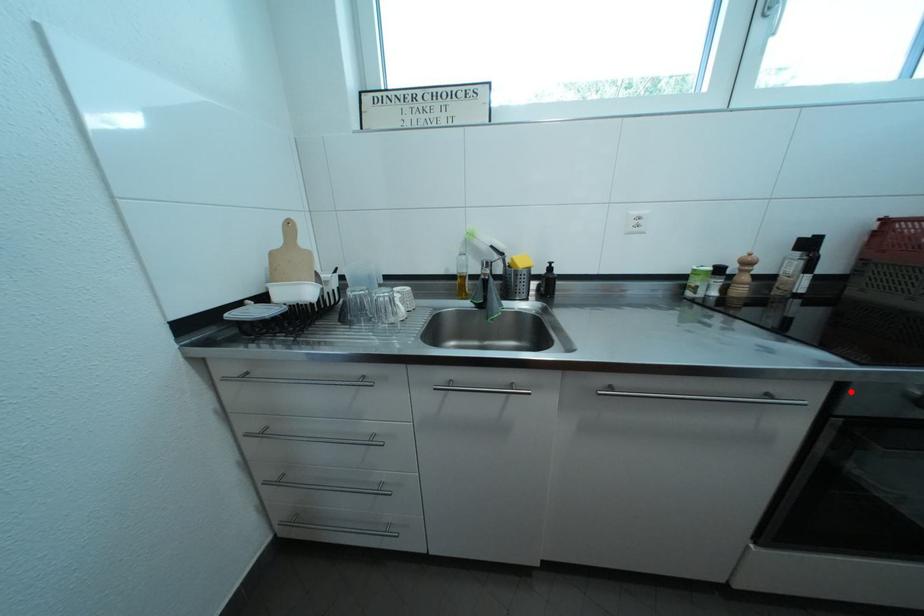
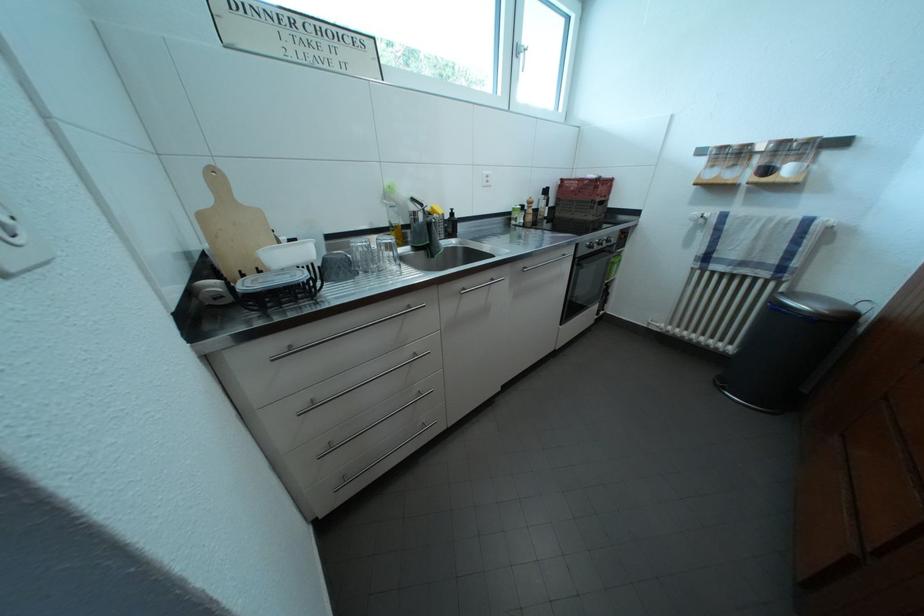
Locate, in the second image, the point that corresponds to the highlighted location in the first image.

(587, 251)